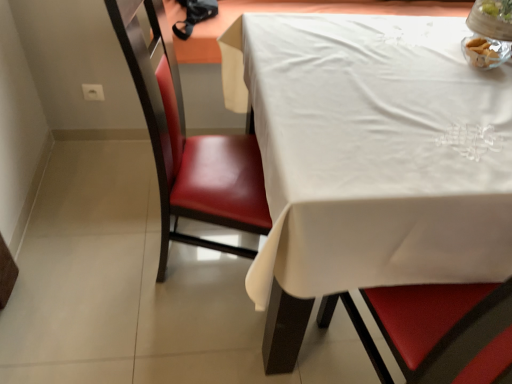
Locate an element on the screen. The width and height of the screenshot is (512, 384). vacant space that is to the left of clear glass bowl at upper right is located at coordinates (429, 39).